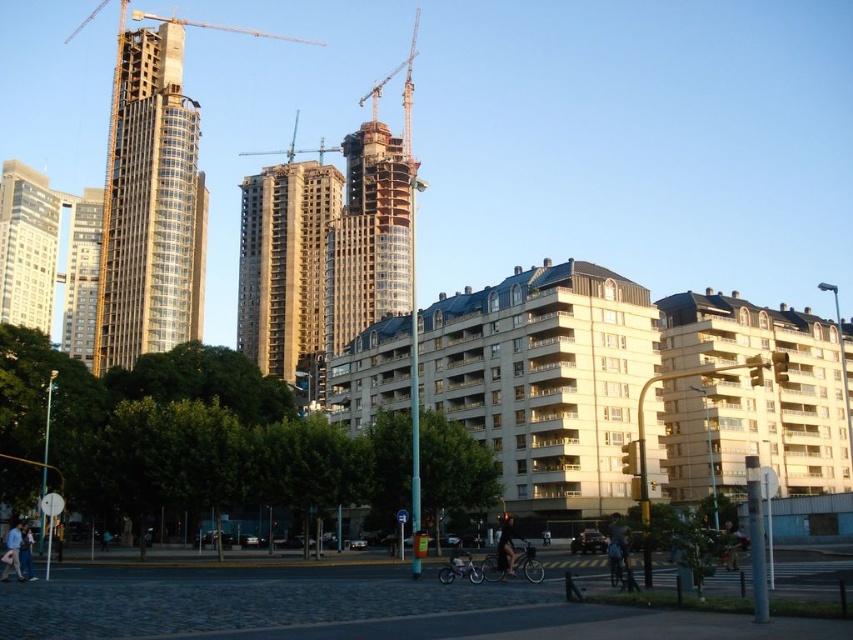
Does gold glass building at center appear on the right side of black matte bicycle at center?

In fact, gold glass building at center is to the left of black matte bicycle at center.

Does point (288, 168) come closer to viewer compared to point (512, 556)?

That is False.

Does point (312, 216) lie in front of point (502, 532)?

No, it is behind (502, 532).

Where is `gold glass building at center`? gold glass building at center is located at coordinates (286, 269).

Who is positioned more to the right, gold glass tower at center or matte glass skyscraper at upper left?

From the viewer's perspective, gold glass tower at center appears more on the right side.

Between gold glass tower at center and matte glass skyscraper at upper left, which one is positioned lower?

matte glass skyscraper at upper left is lower down.

Who is more distant from viewer, (126, 269) or (59, 212)?

Point (59, 212)

Locate an element on the screen. This screenshot has width=853, height=640. gold glass tower at center is located at coordinates (149, 205).

Is point (401, 292) positioned after point (503, 572)?

Yes, it is behind point (503, 572).

Based on the photo, does brown textured building at center have a lesser height compared to black matte bicycle at center?

No.

Where is `brown textured building at center`? brown textured building at center is located at coordinates (368, 240).

Find the location of a particular element. brown textured building at center is located at coordinates (368, 240).